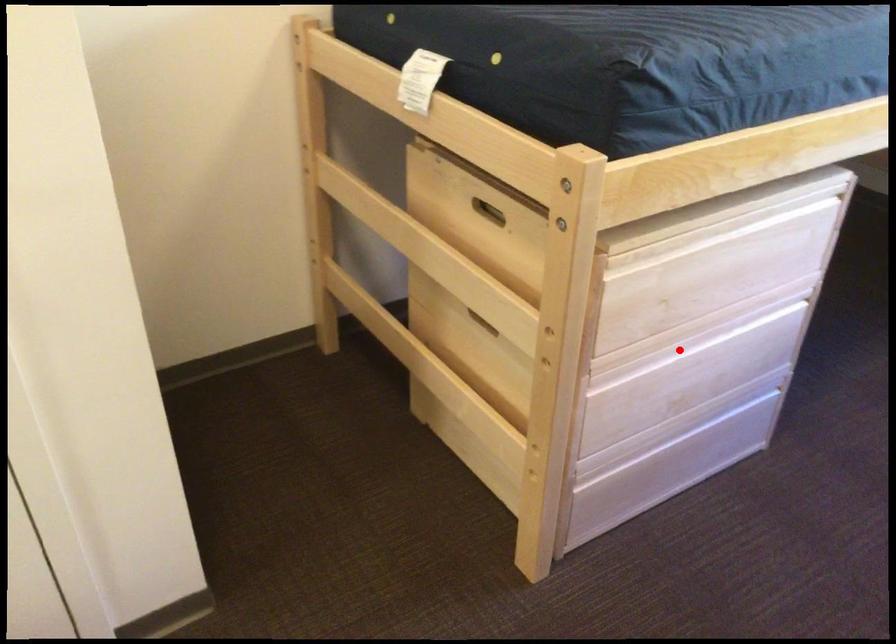
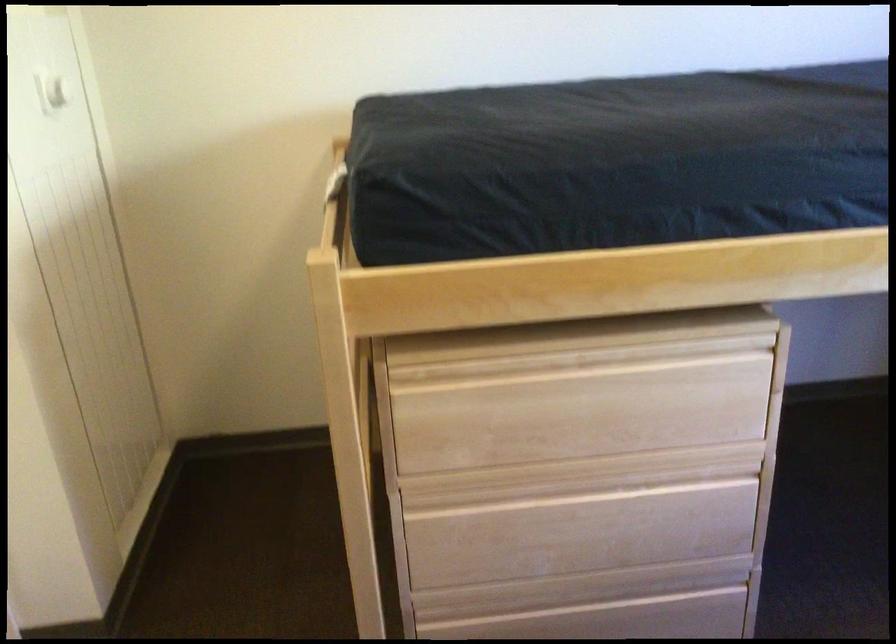
Question: I am providing you with two images of the same scene from different viewpoints. In image1, a red point is highlighted. Considering the same 3D point in image2, which of the following is correct?

Choices:
 (A) It is closer
 (B) It is farther

Answer: (A)